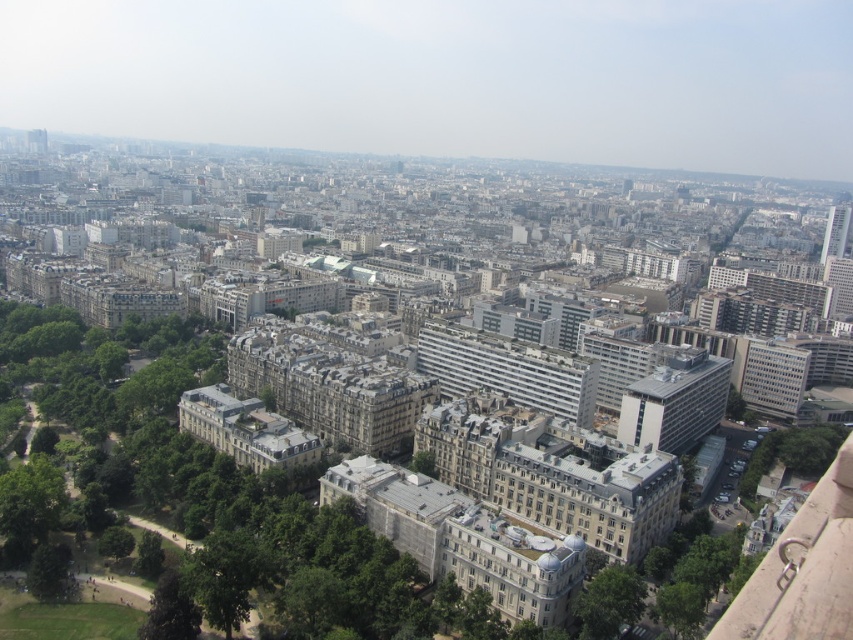
Between point (636, 588) and point (190, 636), which one is positioned in front?

Point (190, 636) is more forward.

Is point (631, 620) closer to camera compared to point (186, 632)?

No, (631, 620) is behind (186, 632).

At what (x,y) coordinates should I click in order to perform the action: click on green leafy tree at lower right. Please return your answer as a coordinate pair (x, y). This screenshot has height=640, width=853. Looking at the image, I should click on click(608, 602).